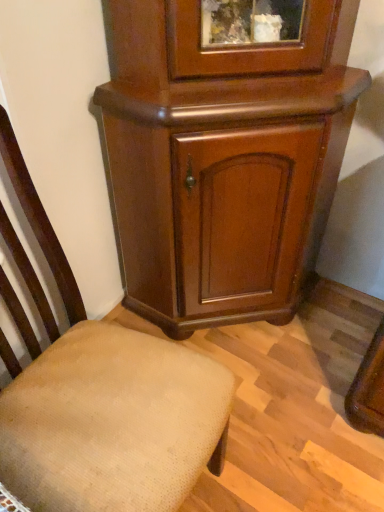
Measure the distance between point (x=240, y=76) and camera.

Point (x=240, y=76) and camera are 3.52 feet apart from each other.

Where is `shiny brown cabinet at center`? This screenshot has width=384, height=512. shiny brown cabinet at center is located at coordinates (223, 158).

What do you see at coordinates (223, 158) in the screenshot? This screenshot has width=384, height=512. I see `shiny brown cabinet at center` at bounding box center [223, 158].

I want to click on beige fabric chair at lower left, so click(x=98, y=394).

What do you see at coordinates (98, 394) in the screenshot?
I see `beige fabric chair at lower left` at bounding box center [98, 394].

The width and height of the screenshot is (384, 512). I want to click on shiny brown cabinet at center, so click(x=223, y=158).

In the scene shown: Is beige fabric chair at lower left to the right of shiny brown cabinet at center from the viewer's perspective?

Incorrect, beige fabric chair at lower left is not on the right side of shiny brown cabinet at center.

Between beige fabric chair at lower left and shiny brown cabinet at center, which one is positioned behind?

shiny brown cabinet at center.

Considering the points (23, 419) and (112, 22), which point is behind, point (23, 419) or point (112, 22)?

The point (112, 22) is more distant.

From the image's perspective, is beige fabric chair at lower left positioned above or below shiny brown cabinet at center?

beige fabric chair at lower left is below shiny brown cabinet at center.

From a real-world perspective, which is physically below, beige fabric chair at lower left or shiny brown cabinet at center?

Answer: From a 3D spatial view, beige fabric chair at lower left is below.

Considering the sizes of beige fabric chair at lower left and shiny brown cabinet at center in the image, is beige fabric chair at lower left wider or thinner than shiny brown cabinet at center?

Considering their sizes, beige fabric chair at lower left looks broader than shiny brown cabinet at center.

Does beige fabric chair at lower left have a lesser height compared to shiny brown cabinet at center?

Yes, beige fabric chair at lower left is shorter than shiny brown cabinet at center.

Considering the relative sizes of beige fabric chair at lower left and shiny brown cabinet at center in the image provided, is beige fabric chair at lower left smaller than shiny brown cabinet at center?

Correct, beige fabric chair at lower left occupies less space than shiny brown cabinet at center.

Would you say beige fabric chair at lower left is inside or outside shiny brown cabinet at center?

beige fabric chair at lower left is spatially situated outside shiny brown cabinet at center.

Is beige fabric chair at lower left positioned far away from shiny brown cabinet at center?

No.

Is shiny brown cabinet at center at the back of beige fabric chair at lower left?

That's not correct — beige fabric chair at lower left is not looking away from shiny brown cabinet at center.

How different are the orientations of beige fabric chair at lower left and shiny brown cabinet at center in degrees?

beige fabric chair at lower left and shiny brown cabinet at center are facing 51 degrees away from each other.

Identify the location of chair in front of the shiny brown cabinet at center. The width and height of the screenshot is (384, 512). (98, 394).

Which is more to the right, shiny brown cabinet at center or beige fabric chair at lower left?

shiny brown cabinet at center is more to the right.

Is the position of shiny brown cabinet at center less distant than that of beige fabric chair at lower left?

No.

Which is in front, point (315, 59) or point (164, 376)?

The point (164, 376) is more forward.

From the image's perspective, is shiny brown cabinet at center above or below beige fabric chair at lower left?

Based on their image positions, shiny brown cabinet at center is located above beige fabric chair at lower left.

From a real-world perspective, which object rests below the other?

From a 3D spatial view, beige fabric chair at lower left is below.

Considering the relative sizes of shiny brown cabinet at center and beige fabric chair at lower left in the image provided, is shiny brown cabinet at center wider than beige fabric chair at lower left?

In fact, shiny brown cabinet at center might be narrower than beige fabric chair at lower left.

Does shiny brown cabinet at center have a greater height compared to beige fabric chair at lower left?

Indeed, shiny brown cabinet at center has a greater height compared to beige fabric chair at lower left.

Based on the photo, which of these two, shiny brown cabinet at center or beige fabric chair at lower left, is smaller?

beige fabric chair at lower left is smaller.

Consider the image. Is beige fabric chair at lower left surrounded by shiny brown cabinet at center?

No, beige fabric chair at lower left is not surrounded by shiny brown cabinet at center.

Are shiny brown cabinet at center and beige fabric chair at lower left located far from each other?

shiny brown cabinet at center is near beige fabric chair at lower left, not far away.

Is shiny brown cabinet at center looking in the opposite direction of beige fabric chair at lower left?

No, shiny brown cabinet at center is not facing the opposite direction of beige fabric chair at lower left.

Where is `chair on the left of shiny brown cabinet at center`? chair on the left of shiny brown cabinet at center is located at coordinates (98, 394).

The height and width of the screenshot is (512, 384). I want to click on cupboard behind the beige fabric chair at lower left, so click(223, 158).

I want to click on chair on the left of the shiny brown cabinet at center, so click(98, 394).